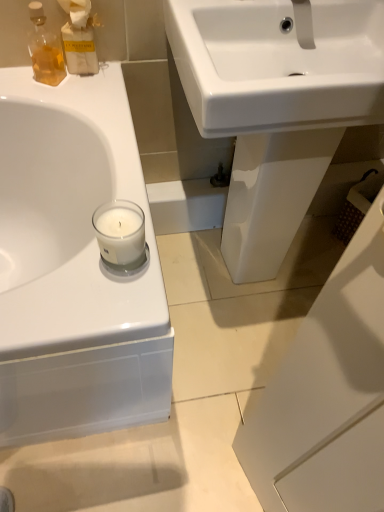
The width and height of the screenshot is (384, 512). Find the location of `free region under white glossy sink at center (from a real-world perspective)`. free region under white glossy sink at center (from a real-world perspective) is located at coordinates (259, 274).